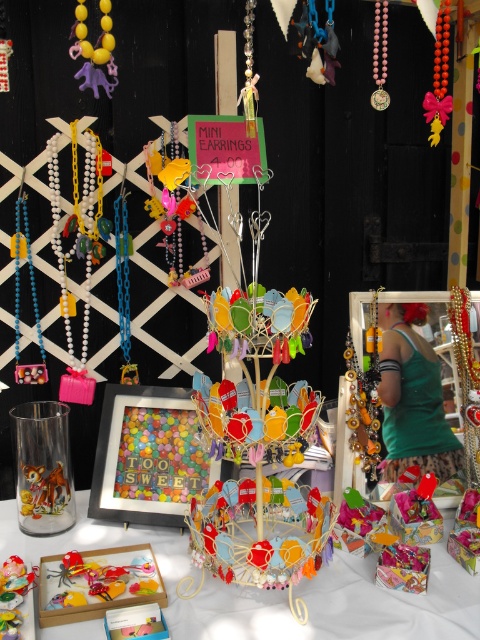
You are a customer at the craft fair looking at the display. You want to see the matte yellow plastic elephant at upper left clearly. However, the matte plastic jewelry at center is blocking your view. What should you do to see the elephant?

Move the matte plastic jewelry at center, as it is currently in front of the matte yellow plastic elephant at upper left and blocking the view.

You are a customer at the craft fair looking at the matte plastic jewelry at center and the matte yellow plastic elephant at upper left. Which object is located to the left of the other?

The matte yellow plastic elephant at upper left is located to the left of the matte plastic jewelry at center.

You are at a craft fair and want to place a small decorative item between the matte plastic jewelry at center and the matte yellow plastic elephant at upper left. The item is 35 inches long. Do you think it will fit perfectly between them?

The distance between the matte plastic jewelry at center and the matte yellow plastic elephant at upper left is 34.91 inches. Since the item is 35 inches long, it is slightly longer than the available space. Therefore, it won not fit perfectly between them.